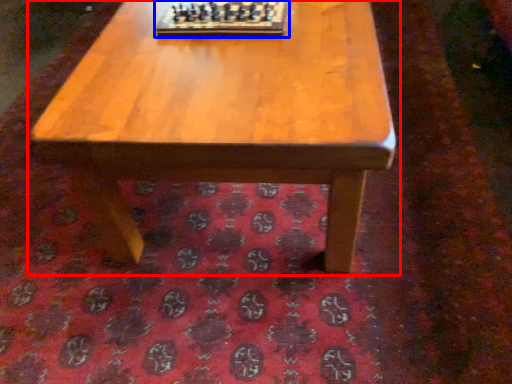
Question: Which object appears farthest to the camera in this image, coffee table (highlighted by a red box) or board game (highlighted by a blue box)?

Choices:
 (A) coffee table
 (B) board game

Answer: (B)